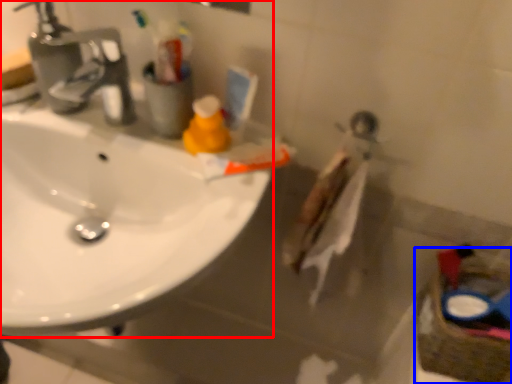
Question: Which point is further to the camera, sink (highlighted by a red box) or basket (highlighted by a blue box)?

Choices:
 (A) sink
 (B) basket

Answer: (B)